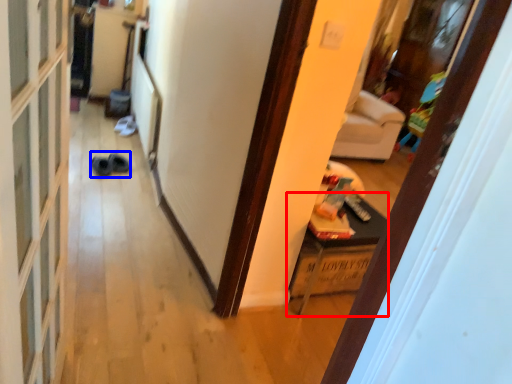
Question: Which point is closer to the camera, furniture (highlighted by a red box) or shoe (highlighted by a blue box)?

Choices:
 (A) furniture
 (B) shoe

Answer: (A)